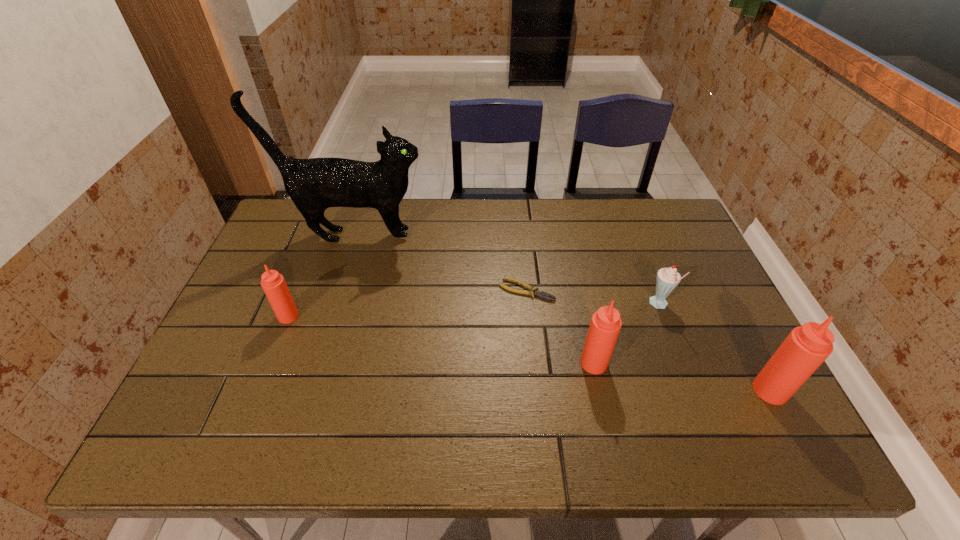
Image resolution: width=960 pixels, height=540 pixels. I want to click on empty space between the leftmost Tabasco sauce and the tallest object, so click(322, 276).

At what (x,y) coordinates should I click in order to perform the action: click on vacant space that's between the shortest Tabasco sauce and the second Tabasco sauce from left to right. Please return your answer as a coordinate pair (x, y). The image size is (960, 540). Looking at the image, I should click on (442, 340).

You are a GUI agent. You are given a task and a screenshot of the screen. Output one action in this format:
    pyautogui.click(x=<x>, y=<y>)
    Task: Click on the unoccupied position between the second Tabasco sauce from left to right and the nearest object
    Image resolution: width=960 pixels, height=540 pixels.
    Given the screenshot: What is the action you would take?
    point(682,377)

I want to click on blank region between the third object from right to left and the milkshake, so click(x=627, y=334).

Select which object appears as the closest to the second shortest Tabasco sauce. Please provide its 2D coordinates. Your answer should be formatted as a tuple, i.e. [(x, y)], where the tuple contains the x and y coordinates of a point satisfying the conditions above.

[(531, 291)]

Identify the location of the fifth closest object to the nearest Tabasco sauce. Image resolution: width=960 pixels, height=540 pixels. (274, 285).

Where is `the second closest Tabasco sauce to the nearest object`? the second closest Tabasco sauce to the nearest object is located at coordinates (274, 285).

Where is `the closest Tabasco sauce to the fourth object from right to left`? This screenshot has width=960, height=540. the closest Tabasco sauce to the fourth object from right to left is located at coordinates (605, 325).

Where is `free space that satisfies the following two spatial constraints: 1. on the straw side of the milkshake; 2. on the right side of the nearest Tabasco sauce`? This screenshot has width=960, height=540. free space that satisfies the following two spatial constraints: 1. on the straw side of the milkshake; 2. on the right side of the nearest Tabasco sauce is located at coordinates (692, 390).

Find the location of a particular element. Image resolution: width=960 pixels, height=540 pixels. free space that satisfies the following two spatial constraints: 1. on the front side of the nearest Tabasco sauce; 2. on the left side of the shortest Tabasco sauce is located at coordinates (259, 390).